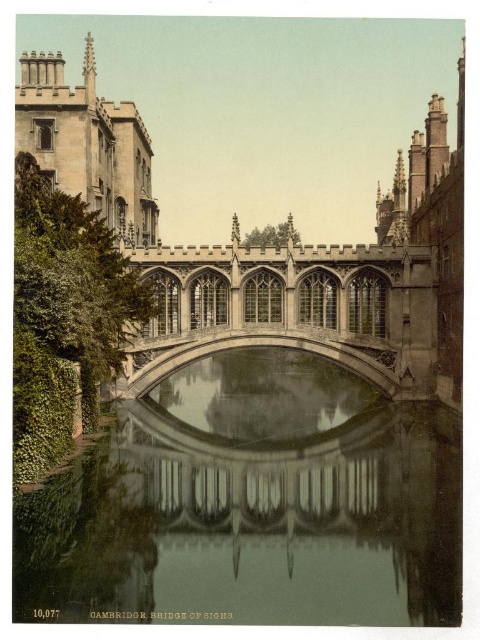
Question: Among these objects, which one is farthest from the camera?

Choices:
 (A) stone gothic arch bridge at center
 (B) clear glass water at center

Answer: (A)

Question: Can you confirm if clear glass water at center is wider than stone gothic arch bridge at center?

Choices:
 (A) no
 (B) yes

Answer: (B)

Question: Does clear glass water at center appear over stone gothic arch bridge at center?

Choices:
 (A) no
 (B) yes

Answer: (A)

Question: Which of the following is the closest to the observer?

Choices:
 (A) clear glass water at center
 (B) stone gothic arch bridge at center

Answer: (A)

Question: Is clear glass water at center to the right of stone gothic arch bridge at center from the viewer's perspective?

Choices:
 (A) yes
 (B) no

Answer: (B)